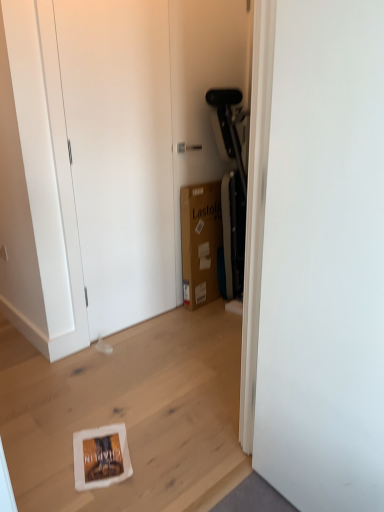
Measure the distance between matte white dresser at center and camera.

The depth of matte white dresser at center is 1.66 meters.

In order to face white matte door at center, which appears as the 2th door when viewed from the back, should I rotate leftwards or rightwards?

Turn right by 17.285 degrees to look at white matte door at center, which appears as the 2th door when viewed from the back.

Describe the element at coordinates (324, 260) in the screenshot. I see `white matte door at center, which appears as the 2th door when viewed from the back` at that location.

Where is `white matte door at upper left, the first door viewed from the left`? Image resolution: width=384 pixels, height=512 pixels. white matte door at upper left, the first door viewed from the left is located at coordinates (120, 154).

Is matte white dresser at center completely or partially inside white matte door at upper left, arranged as the 2th door when viewed from the right?

No, matte white dresser at center is not surrounded by white matte door at upper left, arranged as the 2th door when viewed from the right.

From a real-world perspective, relative to matte white dresser at center, is white matte door at upper left, arranged as the second door when viewed from the front, vertically above or below?

Clearly, from a real-world perspective, white matte door at upper left, arranged as the second door when viewed from the front, is below matte white dresser at center.

Are white matte door at upper left, the first door viewed from the left, and matte white dresser at center far apart?

white matte door at upper left, the first door viewed from the left, is actually quite close to matte white dresser at center.

Considering the positions of objects white matte door at upper left, the first door viewed from the left, and matte white dresser at center in the image provided, who is more to the right, white matte door at upper left, the first door viewed from the left, or matte white dresser at center?

From the viewer's perspective, matte white dresser at center appears more on the right side.

Is point (202, 226) farther from camera compared to point (268, 344)?

Yes, point (202, 226) is farther from viewer.

Based on their positions, is brown cardboard box at center located to the left or right of white matte door at center, which appears as the 2th door when viewed from the back?

Clearly, brown cardboard box at center is on the left of white matte door at center, which appears as the 2th door when viewed from the back, in the image.

From the image's perspective, is brown cardboard box at center located above or below white matte door at center, which appears as the 2th door when viewed from the back?

brown cardboard box at center is above white matte door at center, which appears as the 2th door when viewed from the back.

Considering their positions, is brown cardboard box at center located in front of or behind white matte door at center, positioned as the 2th door in left-to-right order?

brown cardboard box at center is positioned farther from the viewer than white matte door at center, positioned as the 2th door in left-to-right order.

Which object is positioned more to the right, white matte door at center, positioned as the 2th door in left-to-right order, or white matte door at upper left, the first door viewed from the left?

From the viewer's perspective, white matte door at center, positioned as the 2th door in left-to-right order, appears more on the right side.

Is point (306, 309) positioned in front of point (100, 182)?

Yes, it is in front of point (100, 182).

Is white matte door at center, positioned as the 2th door in left-to-right order, inside or outside of white matte door at upper left, the first door viewed from the left?

white matte door at center, positioned as the 2th door in left-to-right order, lies outside white matte door at upper left, the first door viewed from the left.

Which of these two, matte white dresser at center or white matte door at upper left, the 1th door when ordered from back to front, stands taller?

Standing taller between the two is matte white dresser at center.

From the image's perspective, which is above, matte white dresser at center or white matte door at upper left, arranged as the 2th door when viewed from the right?

matte white dresser at center, from the image's perspective.

Is matte white dresser at center positioned far away from white matte door at upper left, arranged as the second door when viewed from the front?

No, matte white dresser at center is not far away from white matte door at upper left, arranged as the second door when viewed from the front.

Could you tell me if matte white dresser at center is turned towards white matte door at upper left, arranged as the 2th door when viewed from the right?

Yes.

From the picture: Is matte white dresser at center at the left side of brown cardboard box at center?

Indeed, matte white dresser at center is positioned on the left side of brown cardboard box at center.

In the scene shown: Considering the relative sizes of matte white dresser at center and brown cardboard box at center in the image provided, is matte white dresser at center thinner than brown cardboard box at center?

Yes.

Could you tell me if matte white dresser at center is facing brown cardboard box at center?

Yes, matte white dresser at center faces towards brown cardboard box at center.

Find the location of a particular element. dresser that appears in front of the brown cardboard box at center is located at coordinates (108, 157).

From the image's perspective, who appears lower, matte white dresser at center or white matte door at center, which appears as the 2th door when viewed from the back?

white matte door at center, which appears as the 2th door when viewed from the back, is shown below in the image.

Based on the photo, considering the relative sizes of matte white dresser at center and white matte door at center, which appears as the 2th door when viewed from the back, in the image provided, is matte white dresser at center shorter than white matte door at center, which appears as the 2th door when viewed from the back,?

Incorrect, the height of matte white dresser at center does not fall short of that of white matte door at center, which appears as the 2th door when viewed from the back.

Between matte white dresser at center and white matte door at center, which appears as the 2th door when viewed from the back, which one has smaller width?

With smaller width is matte white dresser at center.

From the image's perspective, who appears lower, white matte door at center, positioned as the 2th door in left-to-right order, or brown cardboard box at center?

white matte door at center, positioned as the 2th door in left-to-right order, appears lower in the image.

Considering the positions of objects white matte door at center, marked as the 1th door in a front-to-back arrangement, and brown cardboard box at center in the image provided, who is more to the right, white matte door at center, marked as the 1th door in a front-to-back arrangement, or brown cardboard box at center?

white matte door at center, marked as the 1th door in a front-to-back arrangement.

Can you confirm if white matte door at center, marked as the 1th door in a front-to-back arrangement, is thinner than brown cardboard box at center?

Indeed, white matte door at center, marked as the 1th door in a front-to-back arrangement, has a lesser width compared to brown cardboard box at center.

Does white matte door at center, positioned as the 2th door in left-to-right order, come behind brown cardboard box at center?

No, it is not.

Locate an element on the screen. This screenshot has width=384, height=512. dresser above the white matte door at upper left, the 1th door when ordered from back to front (from a real-world perspective) is located at coordinates (108, 157).

Locate an element on the screen. cardboard box behind the white matte door at center, positioned as the 2th door in left-to-right order is located at coordinates (200, 242).

In the scene shown: Based on their spatial positions, is white matte door at upper left, the first door viewed from the left, or brown cardboard box at center further from white matte door at center, acting as the 1th door starting from the right?

brown cardboard box at center.

Based on their spatial positions, is matte white dresser at center or white matte door at upper left, arranged as the 2th door when viewed from the right, closer to brown cardboard box at center?

Based on the image, white matte door at upper left, arranged as the 2th door when viewed from the right, appears to be nearer to brown cardboard box at center.

When comparing their distances from matte white dresser at center, does brown cardboard box at center or white matte door at center, positioned as the 2th door in left-to-right order, seem closer?

brown cardboard box at center is closer to matte white dresser at center.

Considering their positions, is white matte door at center, acting as the 1th door starting from the right, positioned further to matte white dresser at center than brown cardboard box at center?

Among the two, white matte door at center, acting as the 1th door starting from the right, is located further to matte white dresser at center.

Based on their spatial positions, is brown cardboard box at center or white matte door at upper left, the 1th door when ordered from back to front, closer to matte white dresser at center?

Among the two, white matte door at upper left, the 1th door when ordered from back to front, is located nearer to matte white dresser at center.

Considering their positions, is brown cardboard box at center positioned further to white matte door at upper left, arranged as the second door when viewed from the front, than matte white dresser at center?

brown cardboard box at center.

In the scene shown: When comparing their distances from matte white dresser at center, does white matte door at center, which appears as the 2th door when viewed from the back, or white matte door at upper left, the 1th door when ordered from back to front, seem closer?

The object closer to matte white dresser at center is white matte door at upper left, the 1th door when ordered from back to front.

Looking at the image, which one is located further to brown cardboard box at center, white matte door at center, positioned as the 2th door in left-to-right order, or white matte door at upper left, the 1th door when ordered from back to front?

white matte door at center, positioned as the 2th door in left-to-right order, is positioned further to the anchor brown cardboard box at center.

This screenshot has height=512, width=384. I want to click on dresser located between white matte door at center, marked as the 1th door in a front-to-back arrangement, and white matte door at upper left, arranged as the 2th door when viewed from the right, in the depth direction, so click(x=108, y=157).

The width and height of the screenshot is (384, 512). What are the coordinates of `door positioned between matte white dresser at center and brown cardboard box at center from near to far` in the screenshot? It's located at click(x=120, y=154).

Where is `door between white matte door at center, acting as the 1th door starting from the right, and brown cardboard box at center in the front-back direction`? Image resolution: width=384 pixels, height=512 pixels. door between white matte door at center, acting as the 1th door starting from the right, and brown cardboard box at center in the front-back direction is located at coordinates (120, 154).

Locate an element on the screen. dresser between white matte door at center, positioned as the 2th door in left-to-right order, and brown cardboard box at center from front to back is located at coordinates (108, 157).